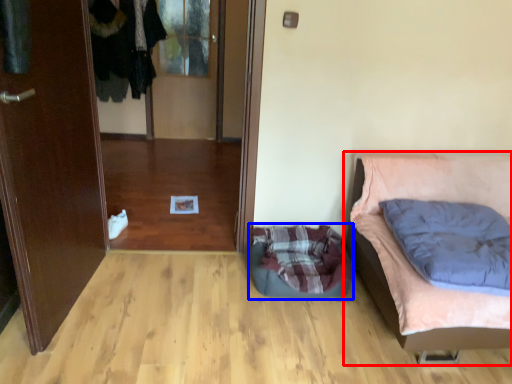
Question: Which point is further to the camera, furniture (highlighted by a red box) or dog bed (highlighted by a blue box)?

Choices:
 (A) furniture
 (B) dog bed

Answer: (B)